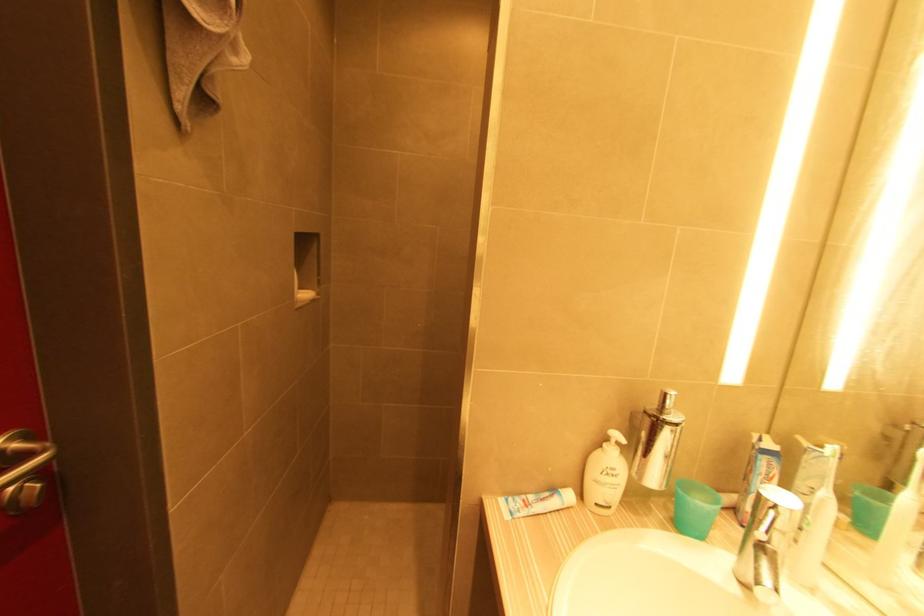
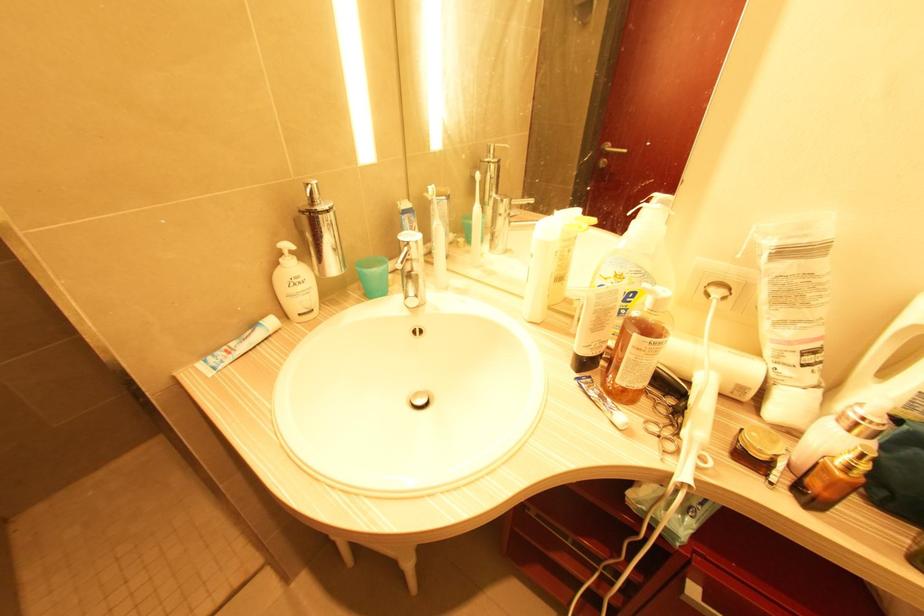
In the second image, find the point that corresponds to the point at 678,426 in the first image.

(329, 212)